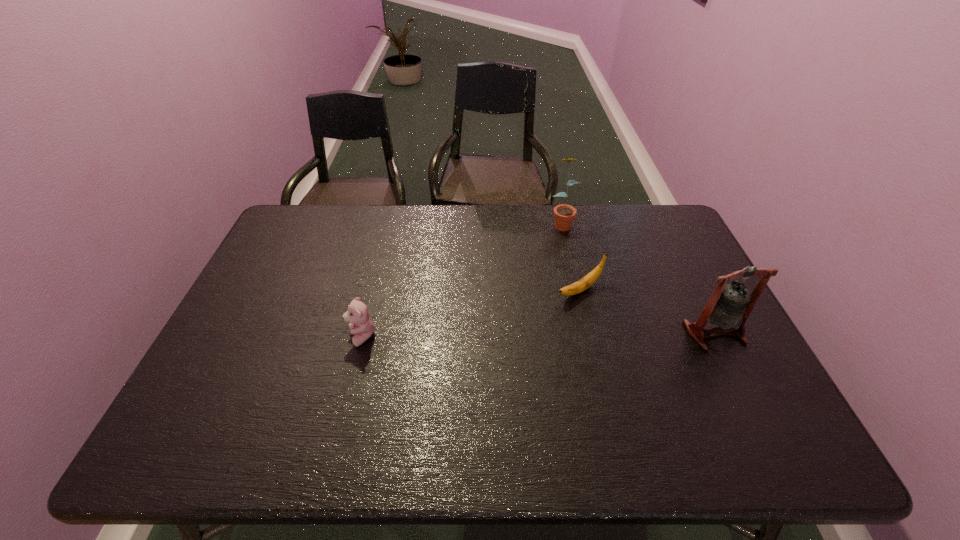
This screenshot has width=960, height=540. In order to click on vacant space at the left edge of the desktop in this screenshot , I will do `click(225, 339)`.

Find the location of a particular element. This screenshot has height=540, width=960. vacant area at the far left corner of the desktop is located at coordinates (311, 213).

In the image, there is a desktop. Where is `vacant space at the near right corner`? This screenshot has width=960, height=540. vacant space at the near right corner is located at coordinates (717, 393).

Locate an element on the screen. Image resolution: width=960 pixels, height=540 pixels. vacant area that lies between the farthest object and the second shortest object is located at coordinates (462, 280).

In order to click on vacant area that lies between the farthest object and the third tallest object in this screenshot , I will do `click(462, 280)`.

Identify the location of vacant space that is in between the rightmost object and the shortest object. The height and width of the screenshot is (540, 960). (648, 312).

Where is `vacant region between the third tallest object and the farthest object`? The height and width of the screenshot is (540, 960). vacant region between the third tallest object and the farthest object is located at coordinates (462, 280).

The height and width of the screenshot is (540, 960). Identify the location of vacant area that lies between the banana and the sunflower. [x=570, y=256].

Find the location of a particular element. vacant region between the banana and the sunflower is located at coordinates 570,256.

Find the location of a particular element. empty location between the bell and the sunflower is located at coordinates (638, 278).